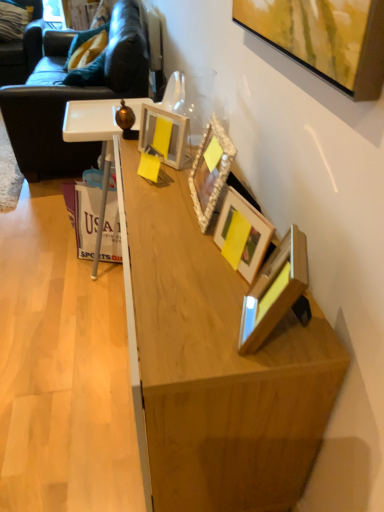
Question: Does wooden picture frame at center, which ranks as the third picture frame in back-to-front order, have a smaller size compared to dark brown leather couch at left?

Choices:
 (A) yes
 (B) no

Answer: (A)

Question: Can we say wooden picture frame at center, which is the 2th picture frame in front-to-back order, lies outside dark brown leather couch at left?

Choices:
 (A) no
 (B) yes

Answer: (B)

Question: From the image's perspective, is wooden picture frame at center, which ranks as the third picture frame in back-to-front order, under dark brown leather couch at left?

Choices:
 (A) no
 (B) yes

Answer: (B)

Question: Considering the relative sizes of wooden picture frame at center, which ranks as the third picture frame in back-to-front order, and dark brown leather couch at left in the image provided, is wooden picture frame at center, which ranks as the third picture frame in back-to-front order, wider than dark brown leather couch at left?

Choices:
 (A) no
 (B) yes

Answer: (A)

Question: From a real-world perspective, is wooden picture frame at center, which ranks as the third picture frame in back-to-front order, physically above dark brown leather couch at left?

Choices:
 (A) no
 (B) yes

Answer: (B)

Question: From a real-world perspective, is wooden picture frame at center, which is the 2th picture frame in front-to-back order, under dark brown leather couch at left?

Choices:
 (A) yes
 (B) no

Answer: (B)

Question: Considering the relative positions of dark brown leather couch at left and wooden desk at center in the image provided, is dark brown leather couch at left behind wooden desk at center?

Choices:
 (A) no
 (B) yes

Answer: (B)

Question: Is dark brown leather couch at left shorter than wooden desk at center?

Choices:
 (A) yes
 (B) no

Answer: (B)

Question: Is dark brown leather couch at left positioned with its back to wooden desk at center?

Choices:
 (A) yes
 (B) no

Answer: (B)

Question: Is dark brown leather couch at left directly adjacent to wooden desk at center?

Choices:
 (A) no
 (B) yes

Answer: (A)

Question: Does dark brown leather couch at left have a lesser width compared to wooden desk at center?

Choices:
 (A) no
 (B) yes

Answer: (A)

Question: Could you tell me if dark brown leather couch at left is turned towards wooden desk at center?

Choices:
 (A) yes
 (B) no

Answer: (B)

Question: Is dark brown leather swivel chair at upper left oriented away from wooden picture frame at center, which ranks as the third picture frame in back-to-front order?

Choices:
 (A) no
 (B) yes

Answer: (A)